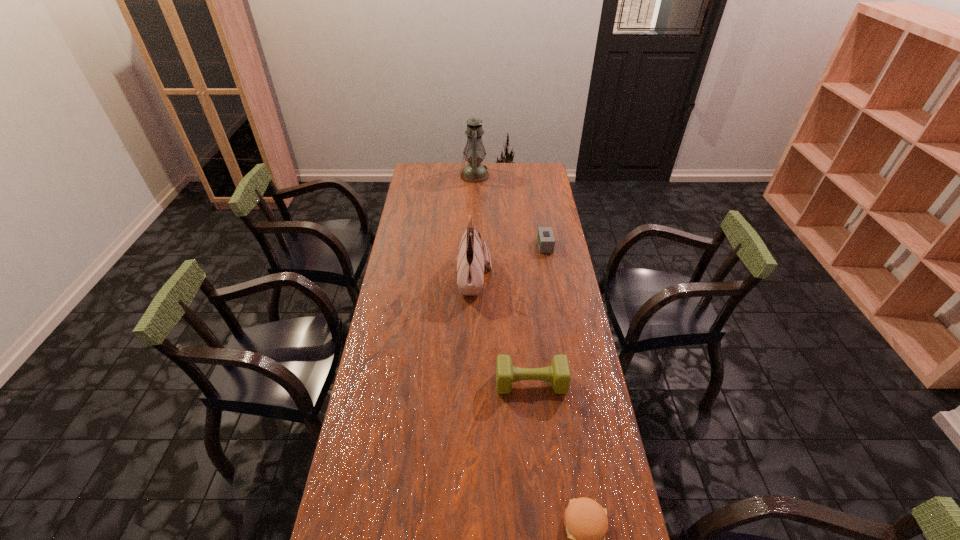
Identify the location of free point between the second nearest object and the handbag. The image size is (960, 540). (503, 330).

Find the location of a particular element. free point between the second shortest object and the farthest object is located at coordinates (510, 211).

Point out which object is positioned as the third nearest to the fourth tallest object. Please provide its 2D coordinates. Your answer should be formatted as a tuple, i.e. [(x, y)], where the tuple contains the x and y coordinates of a point satisfying the conditions above.

[(558, 373)]

This screenshot has width=960, height=540. I want to click on the third closest object relative to the second nearest object, so click(x=546, y=241).

Find the location of a particular element. blank space that satisfies the following two spatial constraints: 1. on the front side of the oil lamp; 2. on the right side of the third shortest object is located at coordinates (471, 383).

Identify the location of vacant region that satisfies the following two spatial constraints: 1. on the side of the handbag with the attached pouch; 2. on the left side of the fourth farthest object. (473, 383).